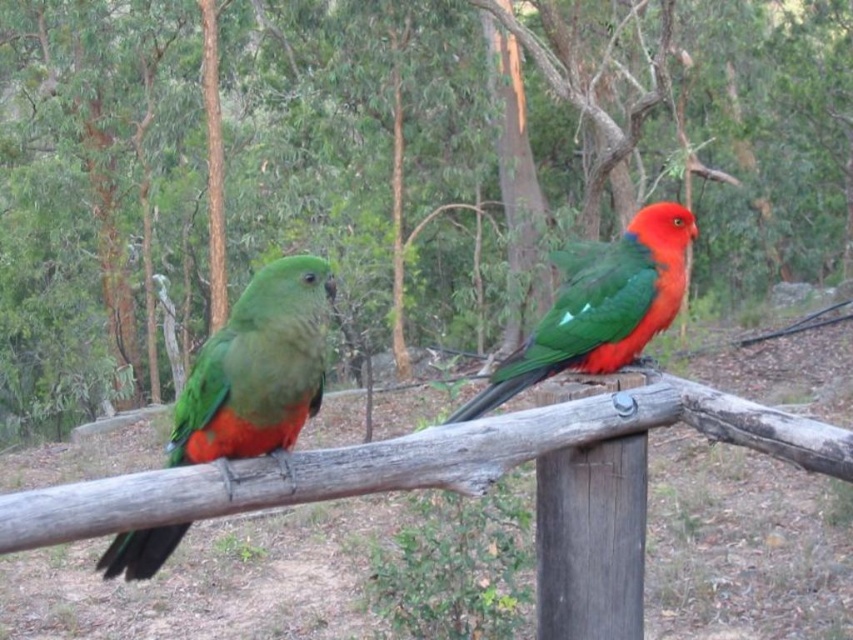
Which of these two, green matte parrot at left or wooden post at center, stands shorter?

green matte parrot at left

Between green matte parrot at left and wooden post at center, which one appears on the left side from the viewer's perspective?

green matte parrot at left

Is point (212, 412) closer to viewer compared to point (584, 460)?

Yes.

You are a GUI agent. You are given a task and a screenshot of the screen. Output one action in this format:
    pyautogui.click(x=<x>, y=<y>)
    Task: Click on the green matte parrot at left
    Image resolution: width=853 pixels, height=640 pixels.
    Given the screenshot: What is the action you would take?
    pyautogui.click(x=256, y=369)

Which is in front, point (453, 74) or point (669, 259)?

Positioned in front is point (669, 259).

Does green wood tree at center have a larger size compared to shiny green parrot at center?

Yes, green wood tree at center is bigger than shiny green parrot at center.

Is point (839, 19) closer to camera compared to point (637, 234)?

No, (839, 19) is further to viewer.

You are a GUI agent. You are given a task and a screenshot of the screen. Output one action in this format:
    pyautogui.click(x=<x>, y=<y>)
    Task: Click on the green wood tree at center
    Image resolution: width=853 pixels, height=640 pixels.
    Given the screenshot: What is the action you would take?
    pyautogui.click(x=531, y=140)

Between point (540, 499) and point (659, 227), which one is positioned behind?

The point (659, 227) is behind.

Looking at this image, does wooden post at center appear on the left side of shiny green parrot at center?

Indeed, wooden post at center is positioned on the left side of shiny green parrot at center.

Who is more forward, (618,499) or (622,358)?

Point (618,499) is more forward.

The width and height of the screenshot is (853, 640). Identify the location of wooden post at center. (590, 540).